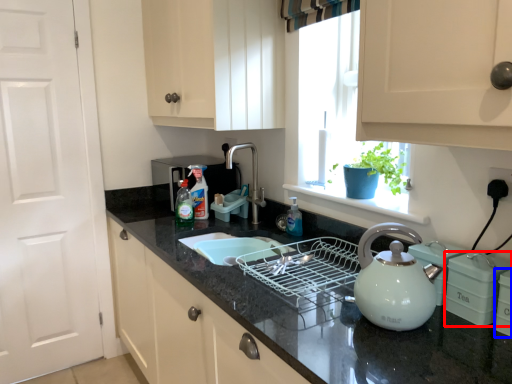
Question: Which of the following is the farthest to the observer, appliance (highlighted by a red box) or appliance (highlighted by a blue box)?

Choices:
 (A) appliance
 (B) appliance

Answer: (A)